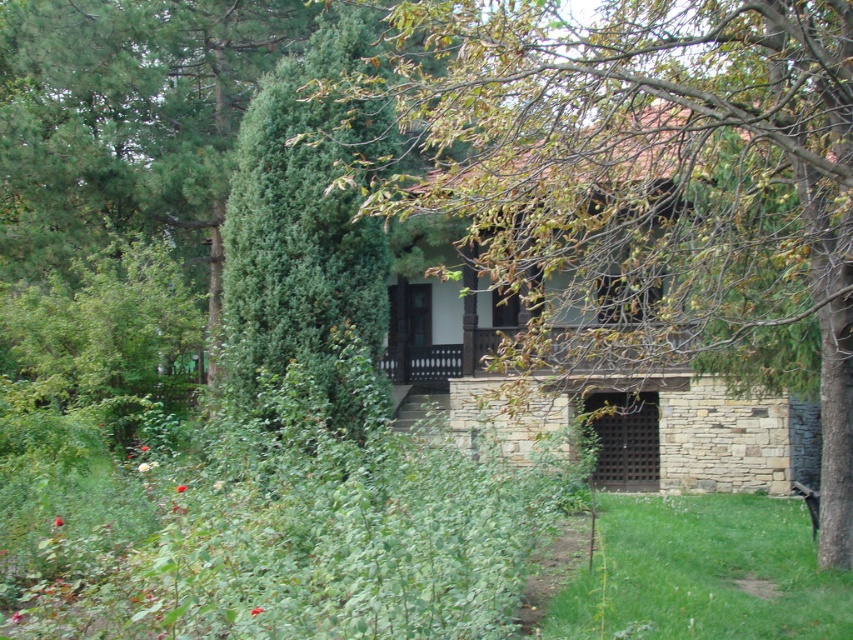
Question: Is green leafy tree at center bigger than green textured bush at center?

Choices:
 (A) no
 (B) yes

Answer: (B)

Question: Considering the relative positions of green leafy tree at center and green textured bush at center in the image provided, where is green leafy tree at center located with respect to green textured bush at center?

Choices:
 (A) below
 (B) above

Answer: (B)

Question: Which point is farther to the camera?

Choices:
 (A) green leafy tree at center
 (B) green textured bush at center

Answer: (B)

Question: Which of the following is the closest to the observer?

Choices:
 (A) (347, 227)
 (B) (703, 225)

Answer: (B)

Question: Is green leafy tree at center above green textured bush at center?

Choices:
 (A) yes
 (B) no

Answer: (A)